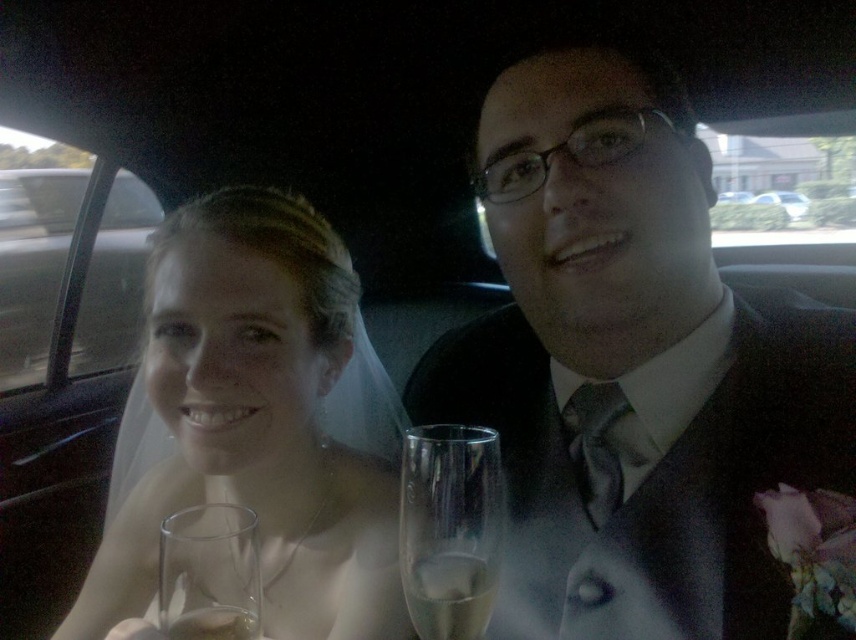
You are a photographer taking pictures of the couple in the car. You notice two glasses on the backseat. The clear glass at left and the clear glass wine glass at lower left. Which glass is closer to the camera?

The clear glass at left is closer to the camera because the clear glass wine glass at lower left is behind it.

You are a photographer standing in front of the car. You want to place a small bouquet of flowers between the clear glass wine glass at lower left and the white glossy car at center. Based on their positions, which object should the bouquet be closer to?

The clear glass wine glass at lower left is positioned on the left side of white glossy car at center, so the bouquet should be placed closer to the clear glass wine glass at lower left to maintain symmetry between the two objects.

Consider the image. You are a bartender preparing drinks for a couple in a car. You have two glasses available. The bride is holding the clear glass at left and the groom is holding the clear glass wine glass at lower left. Which glass can hold more liquid?

The clear glass at left can hold more liquid because it has a larger size compared to the clear glass wine glass at lower left.